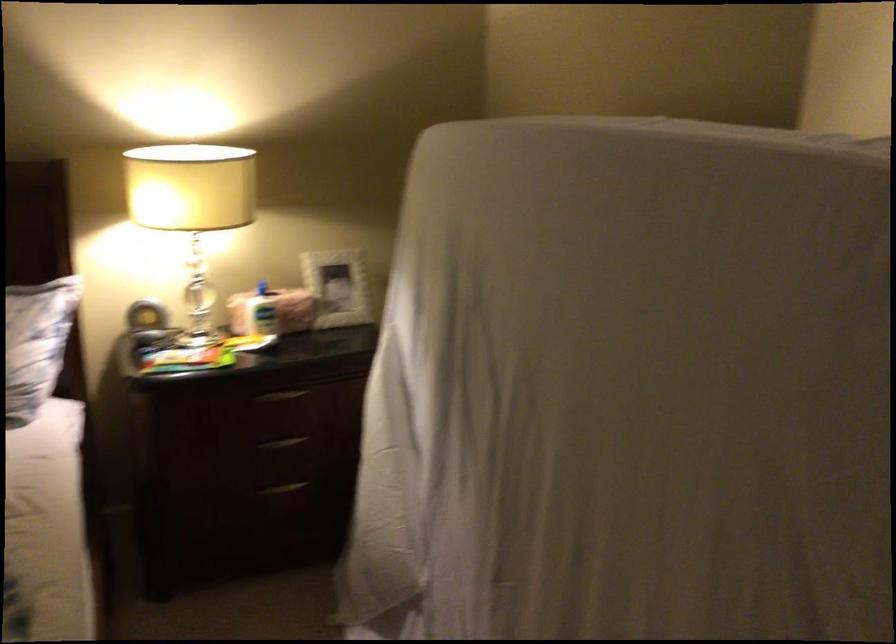
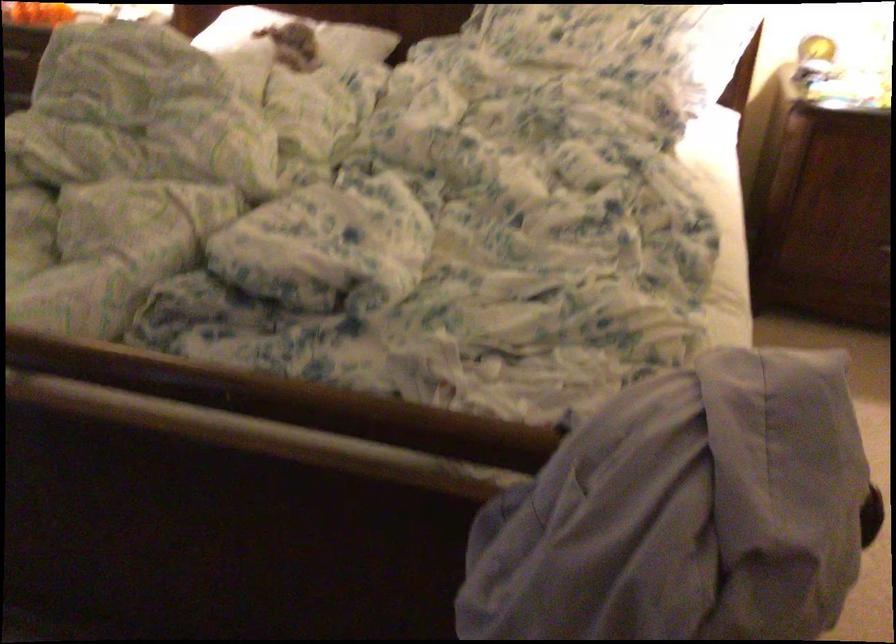
Based on the continuous images, in which direction is the camera rotating?

The camera rotated toward left-down.